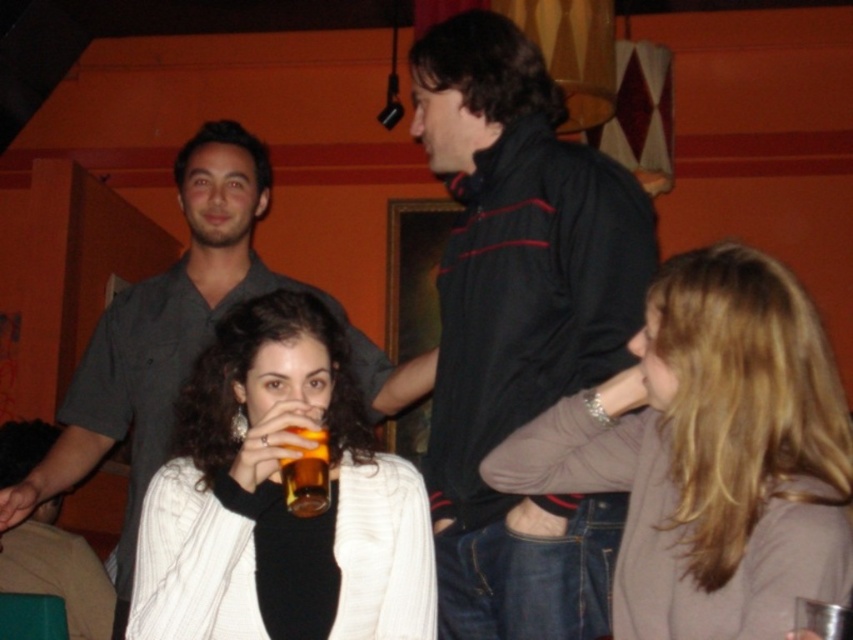
Question: Among these points, which one is nearest to the camera?

Choices:
 (A) (244, 372)
 (B) (535, 563)

Answer: (A)

Question: Is matte gray sweater at center below translucent amber glass at center?

Choices:
 (A) no
 (B) yes

Answer: (A)

Question: Is dark gray shirt at center positioned before translucent amber glass at center?

Choices:
 (A) yes
 (B) no

Answer: (B)

Question: Which is farther from the translucent amber glass at center?

Choices:
 (A) white knit sweater at center
 (B) black fleece jacket at center
 (C) matte gray sweater at center

Answer: (B)

Question: Which of the following is the farthest from the observer?

Choices:
 (A) dark gray shirt at center
 (B) white knit sweater at center
 (C) matte gray sweater at center
 (D) translucent amber glass at center

Answer: (A)

Question: Can you confirm if white knit sweater at center is thinner than dark gray shirt at center?

Choices:
 (A) no
 (B) yes

Answer: (B)